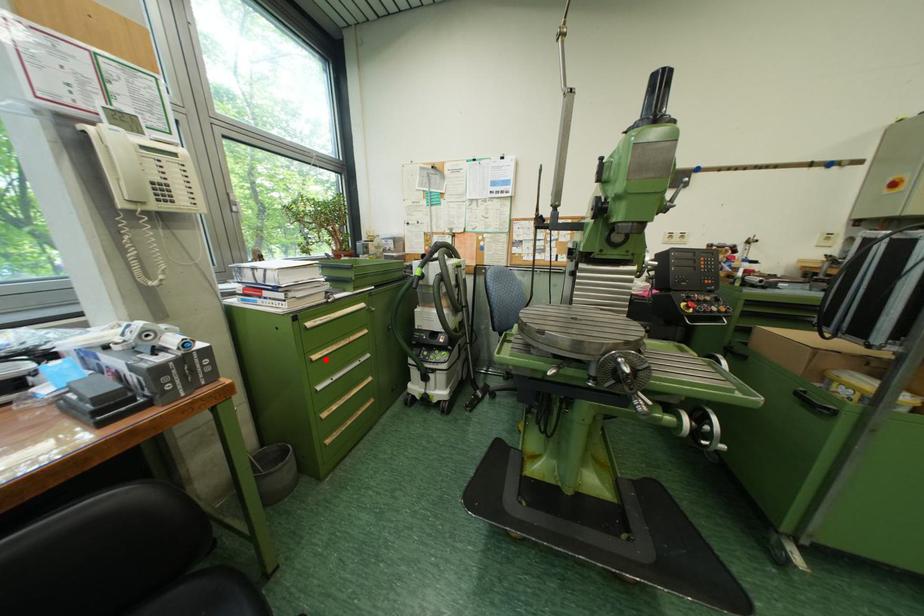
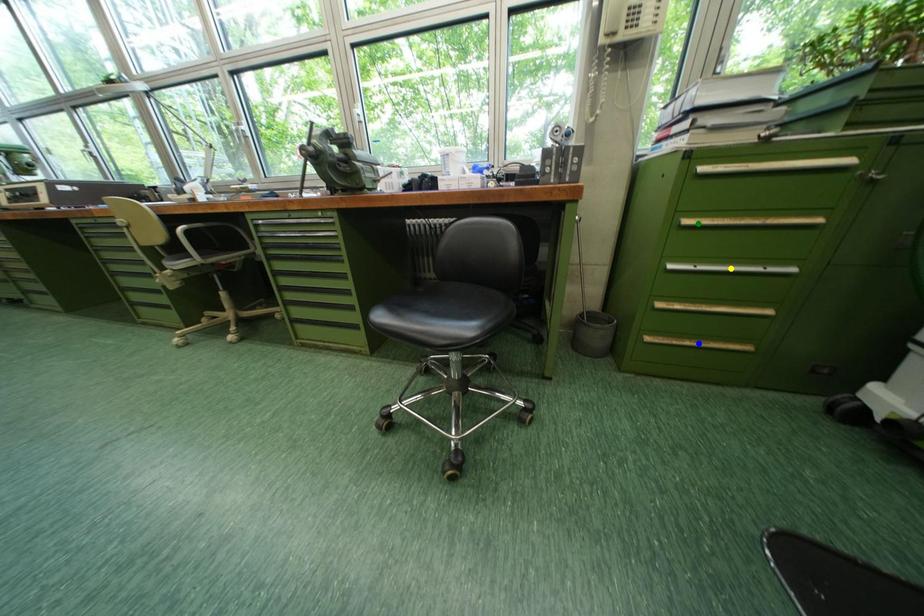
Question: I am providing you with two images of the same scene from different viewpoints. A red point is marked on the first image. You are given multiple points on the second image. Which spot in image 2 lines up with the point in image 1?

Choices:
 (A) green point
 (B) yellow point
 (C) blue point

Answer: (A)